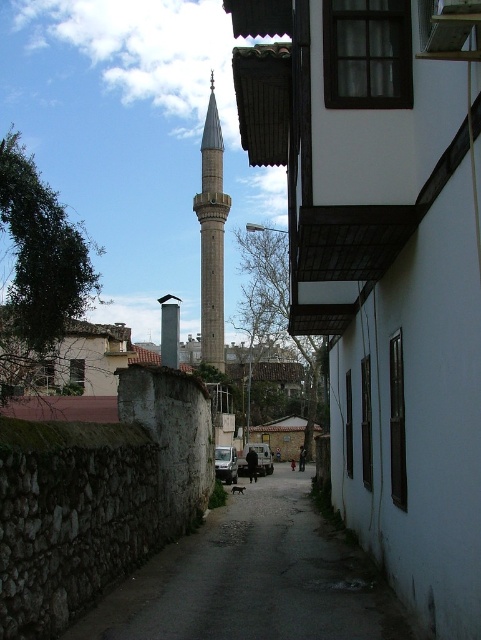
Does stone wall at center appear on the left side of smooth gray chimney at center?

Incorrect, stone wall at center is not on the left side of smooth gray chimney at center.

Does stone wall at center appear on the right side of smooth gray chimney at center?

Correct, you'll find stone wall at center to the right of smooth gray chimney at center.

The height and width of the screenshot is (640, 481). Identify the location of stone wall at center. (253, 579).

Locate an element on the screen. stone wall at center is located at coordinates (253, 579).

Does point (200, 227) lie behind point (175, 307)?

Yes, it is behind point (175, 307).

Is gray stone minaret at center above smooth gray chimney at center?

Correct, gray stone minaret at center is located above smooth gray chimney at center.

Is point (215, 125) positioned in front of point (166, 326)?

That is False.

Identify the location of gray stone minaret at center. (212, 236).

Is point (333, 557) positioned after point (215, 268)?

No, (333, 557) is closer to viewer.

Is stone wall at center wider than gray stone minaret at center?

No.

Image resolution: width=481 pixels, height=640 pixels. Identify the location of stone wall at center. (253, 579).

Where is `stone wall at center`? Image resolution: width=481 pixels, height=640 pixels. stone wall at center is located at coordinates pos(253,579).